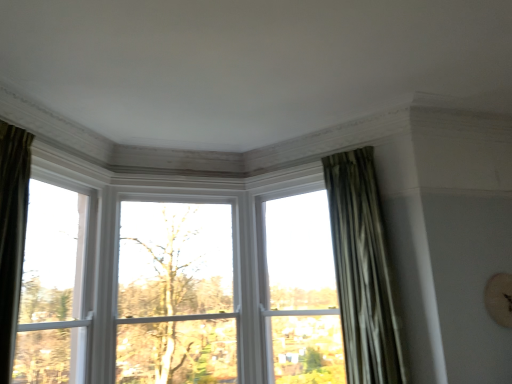
Question: Is silky green curtain at right to the left of white wood window at left, which ranks as the first window in left-to-right order, from the viewer's perspective?

Choices:
 (A) no
 (B) yes

Answer: (A)

Question: Is silky green curtain at right behind white wood window at left, which is the 2th window from right to left?

Choices:
 (A) no
 (B) yes

Answer: (B)

Question: Can you confirm if silky green curtain at right is smaller than white wood window at left, which ranks as the first window in left-to-right order?

Choices:
 (A) no
 (B) yes

Answer: (A)

Question: Can white wood window at left, which is the 2th window from right to left, be found inside silky green curtain at right?

Choices:
 (A) yes
 (B) no

Answer: (B)

Question: Is silky green curtain at right touching white wood window at left, which ranks as the first window in left-to-right order?

Choices:
 (A) yes
 (B) no

Answer: (B)

Question: Is silky green curtain at right looking in the opposite direction of white wood window at left, which ranks as the first window in left-to-right order?

Choices:
 (A) no
 (B) yes

Answer: (A)

Question: Is white wood window at left, which ranks as the first window in left-to-right order, placed right next to silky green curtain at right?

Choices:
 (A) yes
 (B) no

Answer: (B)

Question: Is there a large distance between white wood window at left, which is the 2th window from right to left, and silky green curtain at right?

Choices:
 (A) yes
 (B) no

Answer: (A)

Question: Considering the relative positions of white wood window at left, which is the 2th window from right to left, and silky green curtain at right in the image provided, is white wood window at left, which is the 2th window from right to left, to the right of silky green curtain at right from the viewer's perspective?

Choices:
 (A) no
 (B) yes

Answer: (A)

Question: Would you say white wood window at left, which ranks as the first window in left-to-right order, is outside silky green curtain at right?

Choices:
 (A) yes
 (B) no

Answer: (A)

Question: Considering the relative sizes of white wood window at left, which is the 2th window from right to left, and silky green curtain at right in the image provided, is white wood window at left, which is the 2th window from right to left, taller than silky green curtain at right?

Choices:
 (A) yes
 (B) no

Answer: (B)

Question: From a real-world perspective, is white wood window at left, which is the 2th window from right to left, on top of silky green curtain at right?

Choices:
 (A) no
 (B) yes

Answer: (A)

Question: From a real-world perspective, is green leafy tree at center located higher than clear glass window at center, arranged as the second window when viewed from the left?

Choices:
 (A) no
 (B) yes

Answer: (B)